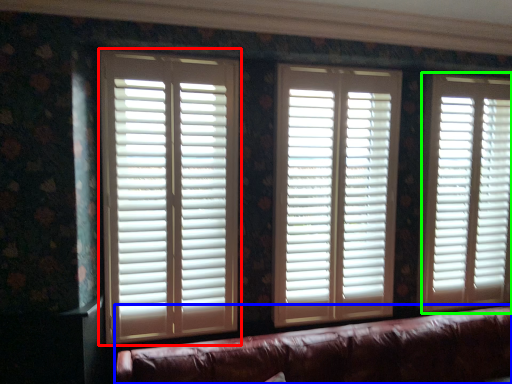
Question: Which object is the closest to the window blind (highlighted by a red box)? Choose among these: studio couch (highlighted by a blue box) or window blind (highlighted by a green box).

Choices:
 (A) studio couch
 (B) window blind

Answer: (A)